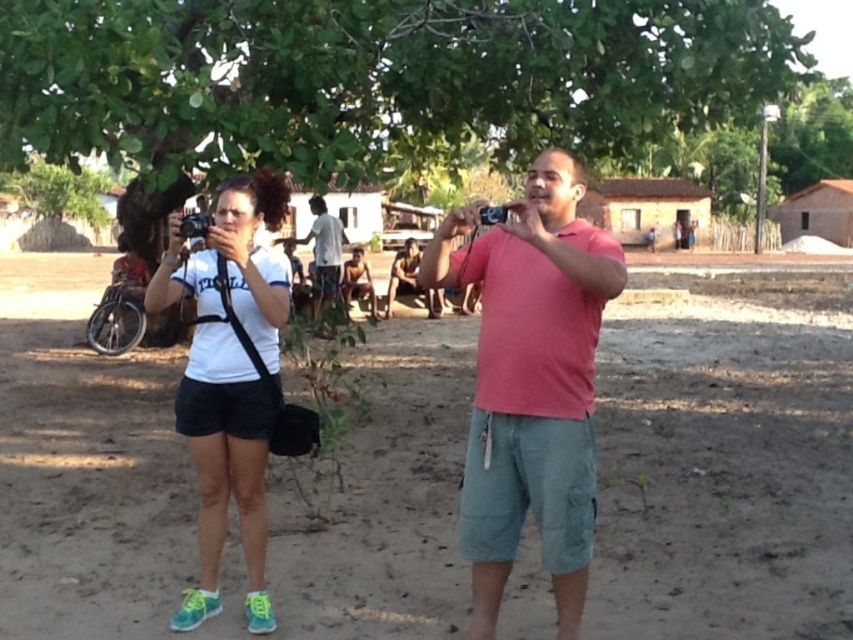
You are standing in the scene and want to take a closer look at the white fabric shirt at center. If you walk 2 meters towards it, will you be able to see it clearly?

The white fabric shirt at center is initially 3.03 meters away. After walking 2 meters closer, the distance becomes 1.03 meters. Since you are now within a reasonable viewing distance, you can see it clearly.

You are standing at the origin point in the scene. Where is the dirt field at center located?

The dirt field at center is located at point (724, 465).